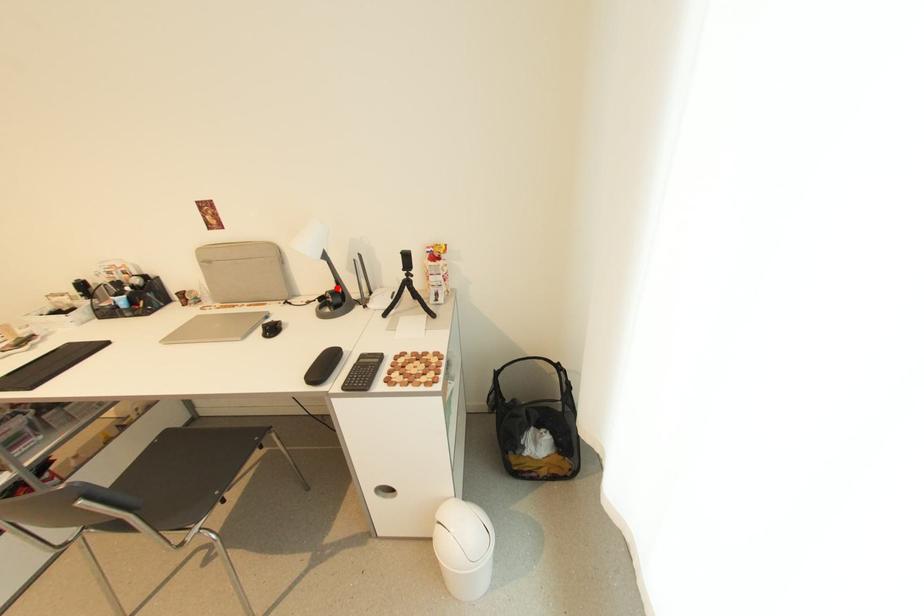
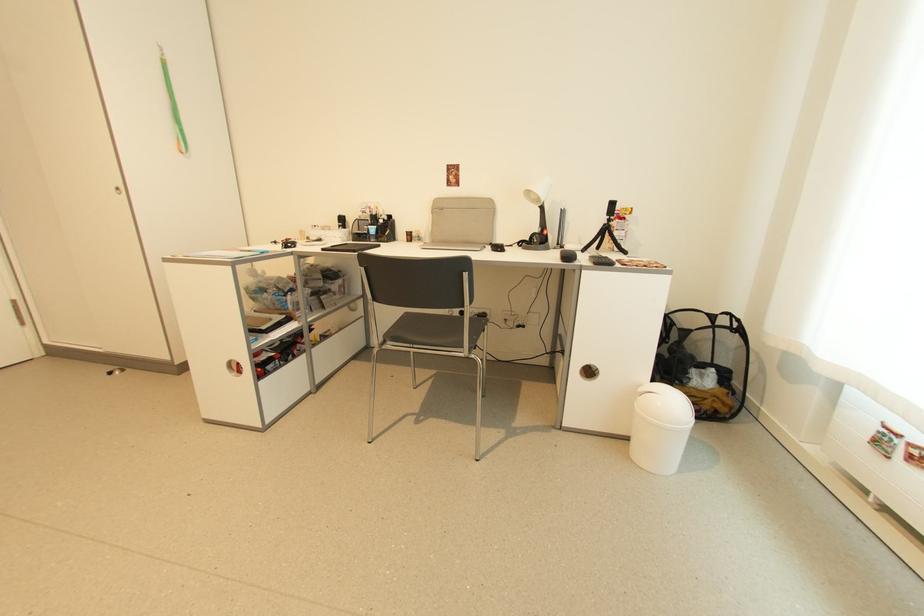
Find the pixel in the second image that matches the highlighted location in the first image.

(541, 232)